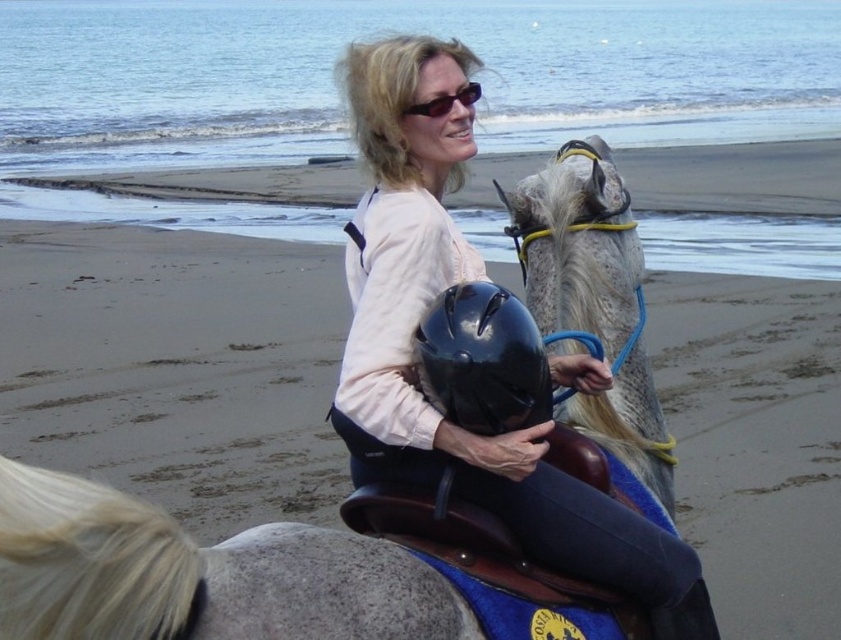
Which is above, black glossy helmet at center or black plastic sunglasses at upper center?

black plastic sunglasses at upper center is higher up.

The width and height of the screenshot is (841, 640). What do you see at coordinates (484, 360) in the screenshot?
I see `black glossy helmet at center` at bounding box center [484, 360].

What are the coordinates of `black glossy helmet at center` in the screenshot? It's located at (484, 360).

Is matte black helmet at center closer to camera compared to black plastic sunglasses at upper center?

Yes.

Does matte black helmet at center appear on the right side of black plastic sunglasses at upper center?

Yes, matte black helmet at center is to the right of black plastic sunglasses at upper center.

The width and height of the screenshot is (841, 640). I want to click on matte black helmet at center, so click(414, 348).

Does point (337, 420) lie in front of point (501, 330)?

No, it is not.

Between point (455, 275) and point (424, 388), which one is positioned behind?

Positioned behind is point (455, 275).

At what (x,y) coordinates should I click in order to perform the action: click on matte black helmet at center. Please return your answer as a coordinate pair (x, y). The width and height of the screenshot is (841, 640). Looking at the image, I should click on (x=414, y=348).